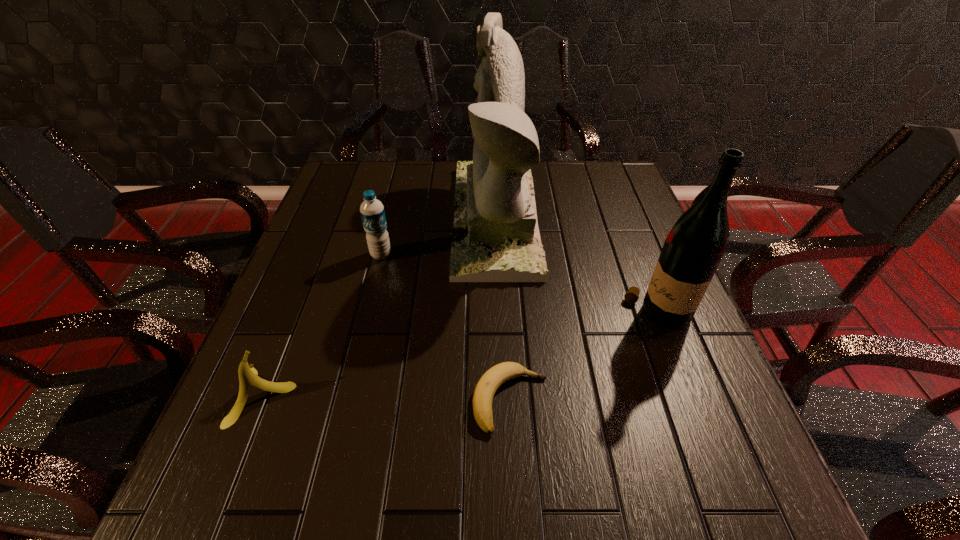
Locate an element on the screen. free spot that satisfies the following two spatial constraints: 1. on the front side of the shortest object; 2. on the right side of the second shortest object is located at coordinates (262, 401).

Identify the location of free space that satisfies the following two spatial constraints: 1. on the surface of the fourth shortest object; 2. on the front side of the left banana. The height and width of the screenshot is (540, 960). (686, 395).

At what (x,y) coordinates should I click in order to perform the action: click on free location that satisfies the following two spatial constraints: 1. on the base of the sculpture; 2. on the front side of the fourth tallest object. Please return your answer as a coordinate pair (x, y). The width and height of the screenshot is (960, 540). Looking at the image, I should click on (503, 395).

Where is `vacant space that satisfies the following two spatial constraints: 1. on the surface of the wine bottle; 2. on the front side of the shortest object`? Image resolution: width=960 pixels, height=540 pixels. vacant space that satisfies the following two spatial constraints: 1. on the surface of the wine bottle; 2. on the front side of the shortest object is located at coordinates (688, 401).

Where is `vacant space that satisfies the following two spatial constraints: 1. on the label of the water bottle; 2. on the left side of the shortest object`? vacant space that satisfies the following two spatial constraints: 1. on the label of the water bottle; 2. on the left side of the shortest object is located at coordinates (346, 401).